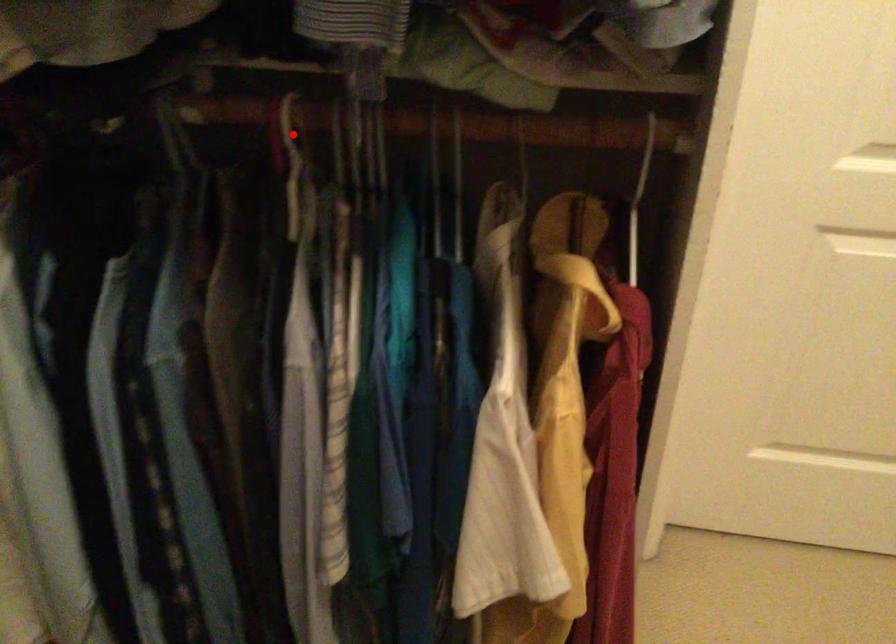
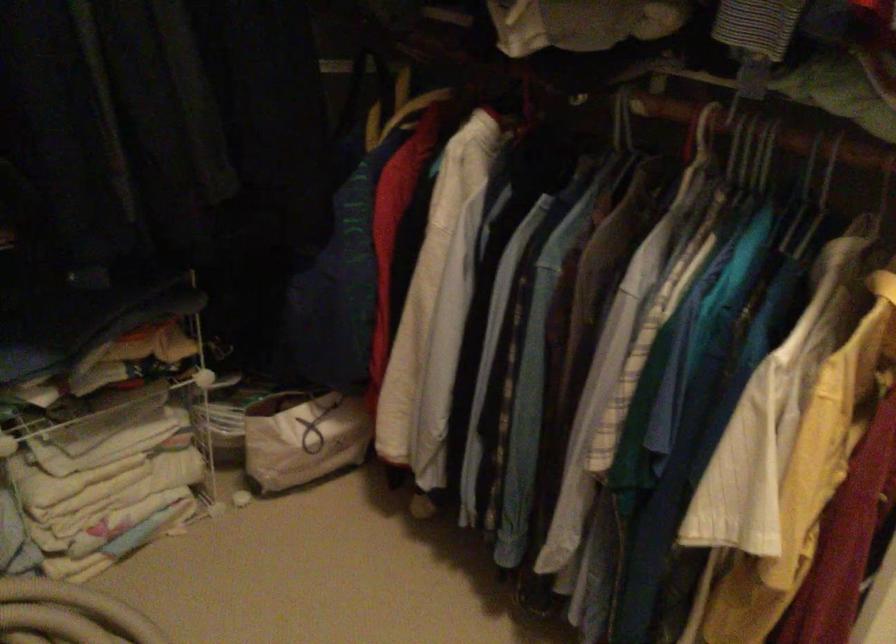
Locate, in the second image, the point that corresponds to the highlighted location in the first image.

(702, 134)